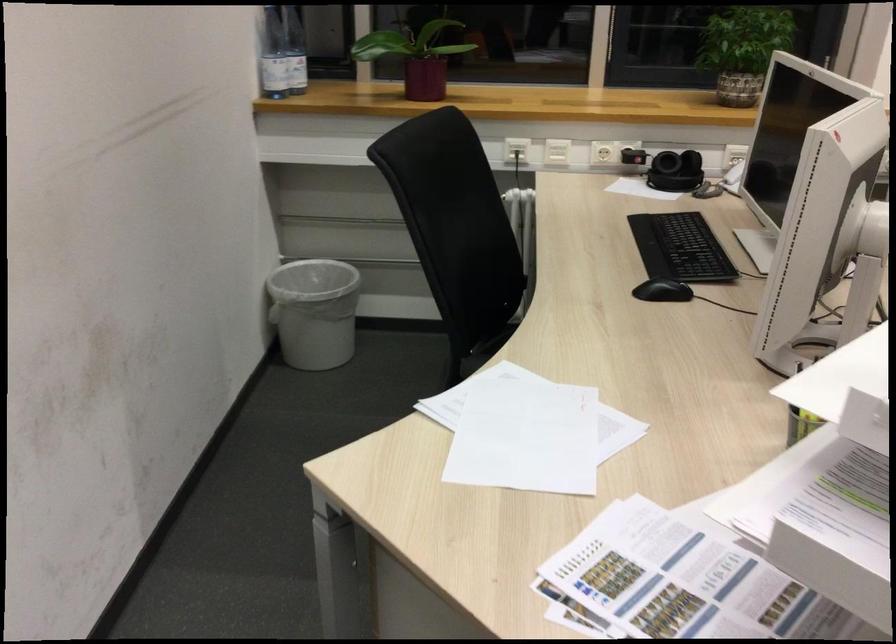
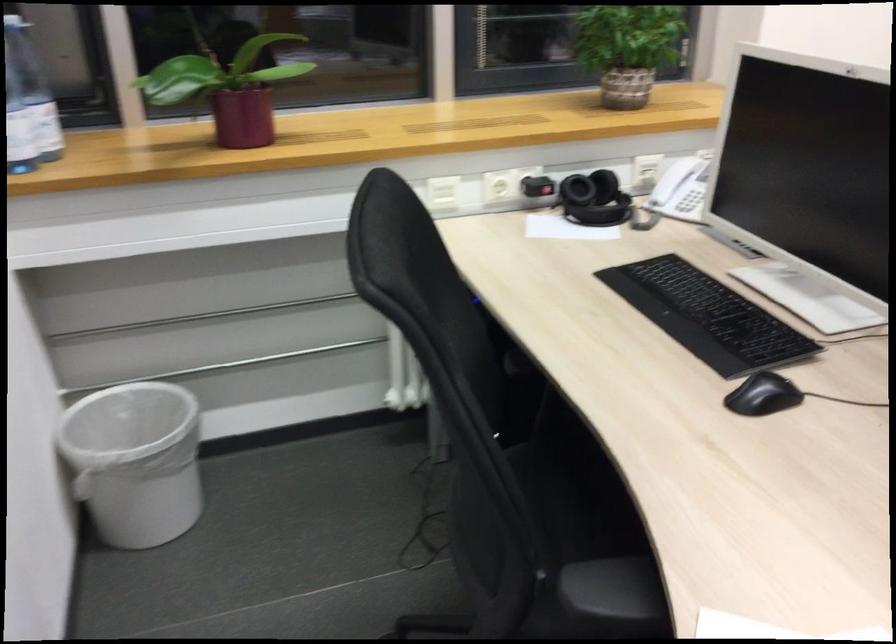
Question: The images are taken continuously from a first-person perspective. In which direction is your viewpoint rotating?

Choices:
 (A) Left
 (B) Right
 (C) Up
 (D) Down

Answer: (B)